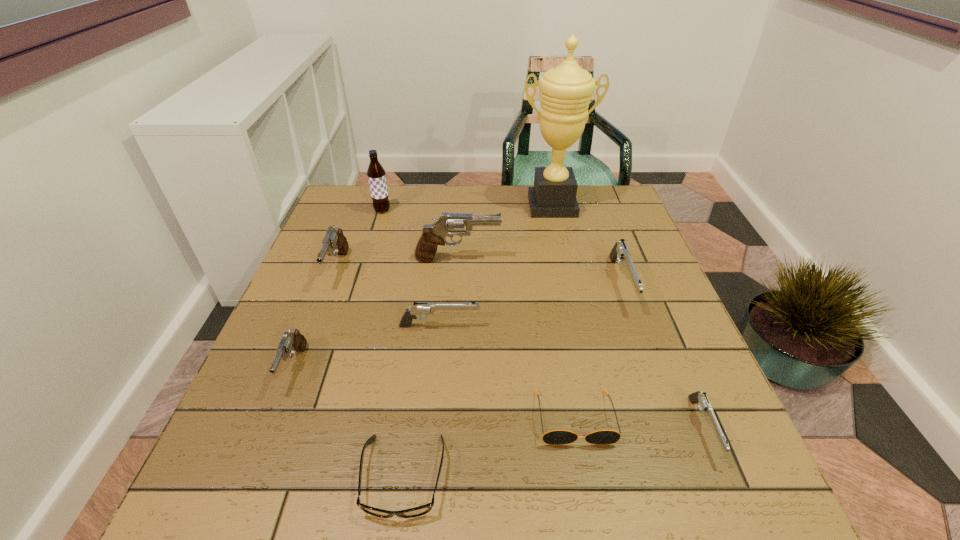
Select which object appears as the eighth closest to the root beer. Please provide its 2D coordinates. Your answer should be formatted as a tuple, i.e. [(x, y)], where the tuple contains the x and y coordinates of a point satisfying the conditions above.

[(556, 437)]

Choose which object is the fourth nearest neighbor to the second smallest silver pistol. Please provide its 2D coordinates. Your answer should be formatted as a tuple, i.e. [(x, y)], where the tuple contains the x and y coordinates of a point satisfying the conditions above.

[(449, 224)]

Where is `the fourth closest pistol to the spectacles`? Image resolution: width=960 pixels, height=540 pixels. the fourth closest pistol to the spectacles is located at coordinates (697, 397).

Locate which pistol is the fourth closest to the eighth shortest object. Please provide its 2D coordinates. Your answer should be formatted as a tuple, i.e. [(x, y)], where the tuple contains the x and y coordinates of a point satisfying the conditions above.

[(291, 341)]

Select which gray pistol is the second closest to the spectacles. Please provide its 2D coordinates. Your answer should be formatted as a tuple, i.e. [(x, y)], where the tuple contains the x and y coordinates of a point satisfying the conditions above.

[(335, 243)]

Select which gray pistol appears as the second closest to the second smallest gray pistol. Please provide its 2D coordinates. Your answer should be formatted as a tuple, i.e. [(x, y)], where the tuple contains the x and y coordinates of a point satisfying the conditions above.

[(449, 224)]

Locate an element on the screen. the second closest silver pistol relative to the seventh tallest object is located at coordinates (697, 397).

Locate an element on the screen. The width and height of the screenshot is (960, 540). silver pistol that stands as the closest to the fourth farthest pistol is located at coordinates point(620,252).

What are the coordinates of `free location that satisfies the following two spatial constraints: 1. at the barrel of the biggest gray pistol; 2. at the barrel of the smallest gray pistol` in the screenshot? It's located at (451, 367).

Locate an element on the screen. vacant region that satisfies the following two spatial constraints: 1. on the front-facing side of the ninth object from left to right; 2. on the front-facing side of the second farthest silver pistol is located at coordinates click(636, 326).